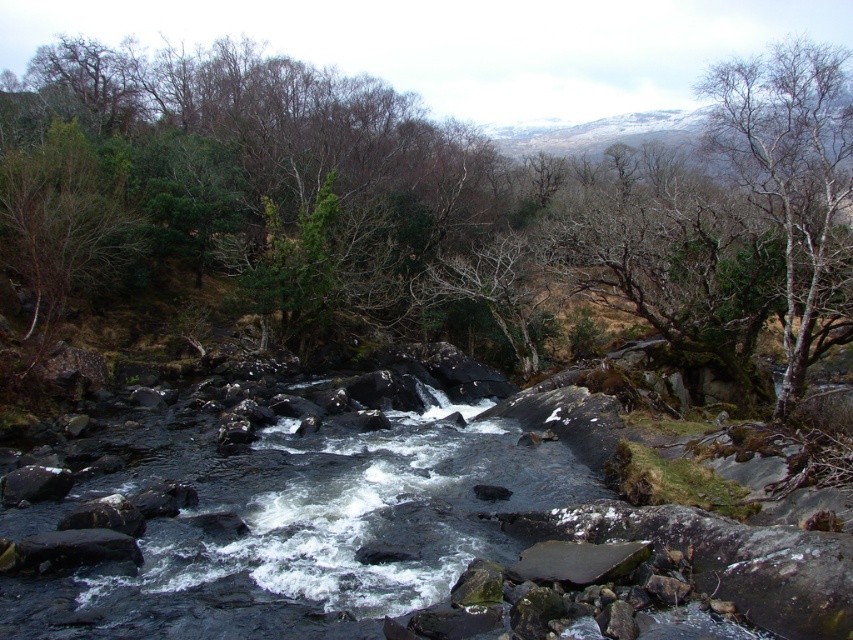
Is point (846, 179) less distant than point (807, 202)?

No, (846, 179) is behind (807, 202).

Which is above, green leafy tree at center or bare bark tree at upper right?

green leafy tree at center is higher up.

Between point (821, 262) and point (770, 97), which one is positioned in front?

Point (821, 262)

The width and height of the screenshot is (853, 640). What are the coordinates of `green leafy tree at center` in the screenshot? It's located at (427, 204).